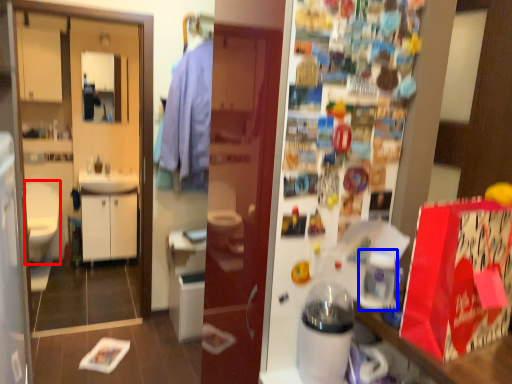
Question: Among these objects, which one is nearest to the camera, sit (highlighted by a red box) or appliance (highlighted by a blue box)?

Choices:
 (A) sit
 (B) appliance

Answer: (B)